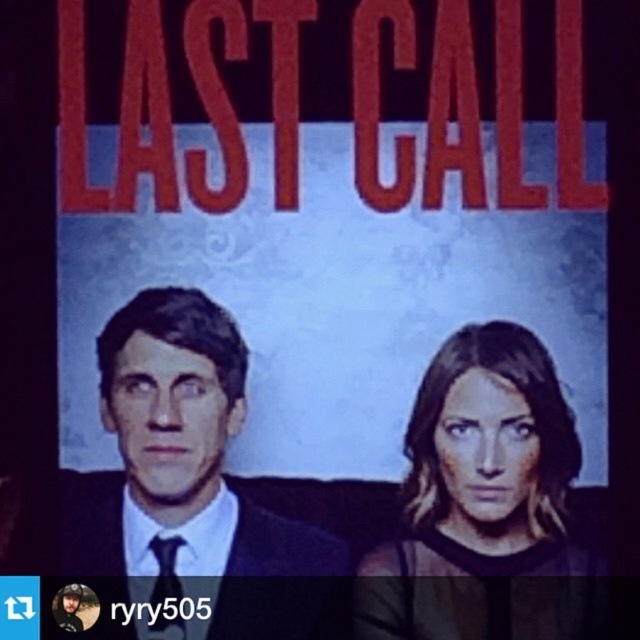
Based on the scene described, which object is positioned closer to the viewer? The matte black suit at left or the smooth brown hair at center?

The matte black suit at left is closer to the viewer because the smooth brown hair at center is positioned behind it.

You are standing in front of the movie poster for Last Call. You notice two points marked on the poster at coordinates point (88, 540) and point (493, 483). Which point is closer to you?

Point (88, 540) is closer to you because it is further to the viewer than point (493, 483).